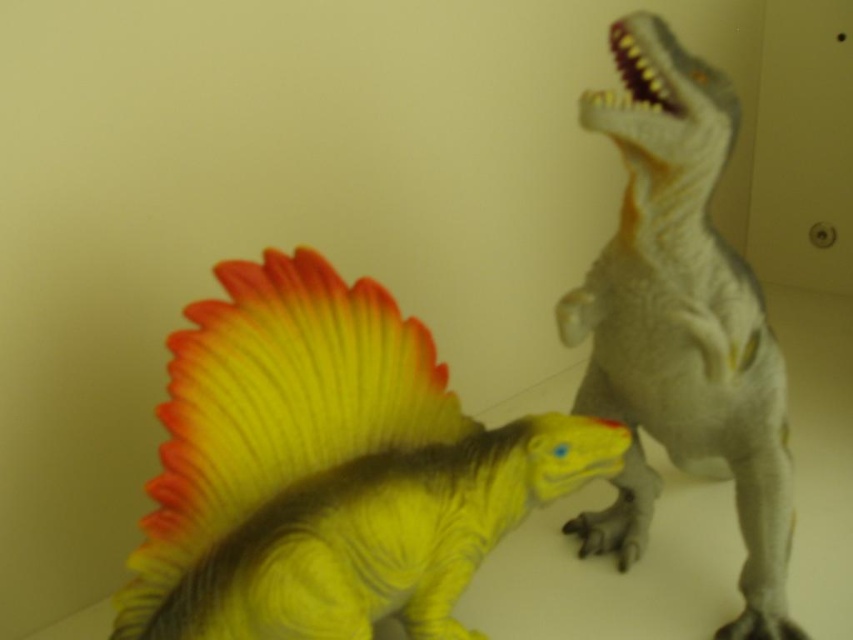
Can you confirm if shiny yellow dinosaur at center is smaller than gray matte plastic dinosaur at upper right?

Correct, shiny yellow dinosaur at center occupies less space than gray matte plastic dinosaur at upper right.

Is shiny yellow dinosaur at center thinner than gray matte plastic dinosaur at upper right?

No.

You are a GUI agent. You are given a task and a screenshot of the screen. Output one action in this format:
    pyautogui.click(x=<x>, y=<y>)
    Task: Click on the shiny yellow dinosaur at center
    This screenshot has width=853, height=640.
    Given the screenshot: What is the action you would take?
    pyautogui.click(x=328, y=468)